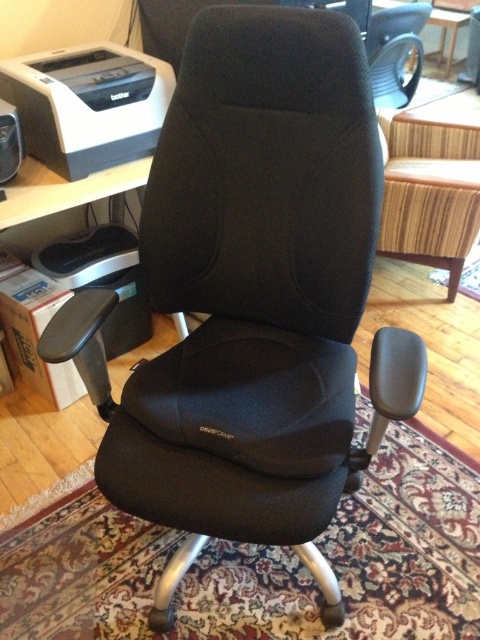
You are setting up a home office and need to place a 10 inch wide laptop between the matte black printer at upper left and the black matte speaker at upper left. Can the laptop fit between them?

The matte black printer at upper left and black matte speaker at upper left are 9.44 inches apart from each other. Since the laptop is 10 inches wide, it cannot fit between them as the space is narrower than the laptop.

Based on the photo, you are setting up a home office and need to place both the matte black printer at upper left and the black matte speaker at upper left on a desk. Which object requires more desk space?

The matte black printer at upper left requires more desk space because it is bigger than the black matte speaker at upper left.